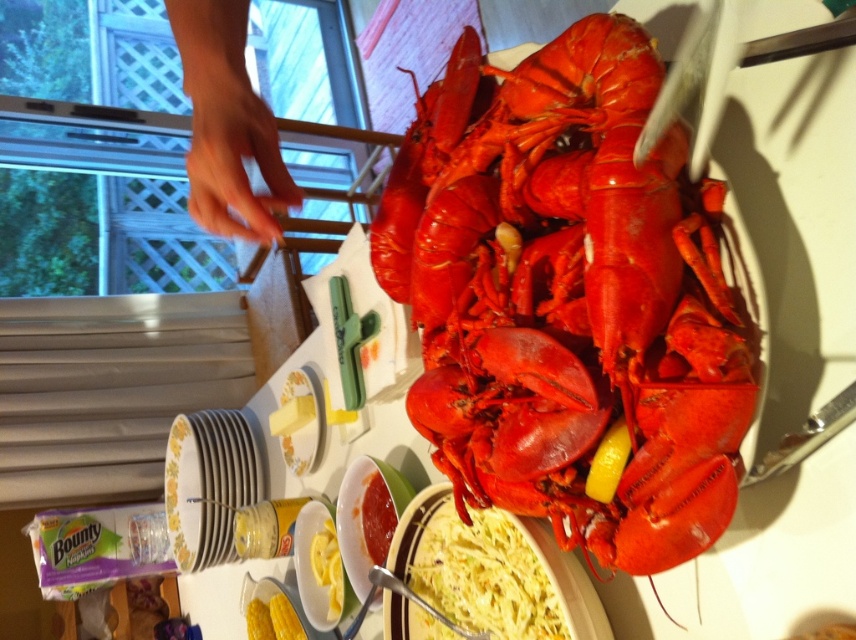
Question: Which point appears farthest from the camera in this image?

Choices:
 (A) (333, 579)
 (B) (498, 356)
 (C) (522, 584)
 (D) (176, 38)

Answer: (A)

Question: Can you confirm if shiny red lobster at center is positioned above smooth creamy pasta at center?

Choices:
 (A) yes
 (B) no

Answer: (A)

Question: Among these points, which one is farthest from the camera?

Choices:
 (A) (468, 588)
 (B) (322, 545)
 (C) (209, 140)

Answer: (B)

Question: Which is nearer to the yellow creamy butter at center?

Choices:
 (A) smooth creamy pasta at center
 (B) skinny hand at upper center

Answer: (A)

Question: Is shiny red lobster at center in front of skinny hand at upper center?

Choices:
 (A) yes
 (B) no

Answer: (B)

Question: Observing the image, what is the correct spatial positioning of shiny red lobster at center in reference to smooth creamy pasta at center?

Choices:
 (A) right
 (B) left

Answer: (A)